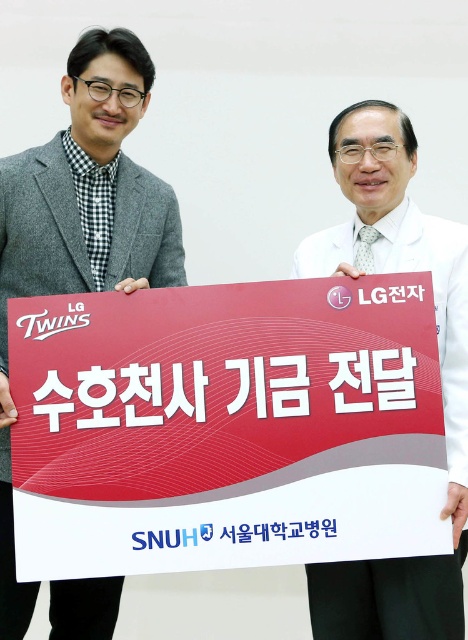
You are a photographer who needs to adjust the lighting to ensure both the red paper sign at center and the white lab coat at center are well lit. Which object should you focus the light on first to account for their size differences?

The red paper sign at center is shorter than the white lab coat at center, so you should focus the light on the white lab coat at center first since it is larger and may require more even lighting to ensure proper exposure.

You are a photographer who needs to position a tripod to capture both the red paper sign at center and the white lab coat at center clearly. Based on their positions, which object should you focus on first to ensure both are in frame?

The red paper sign at center is to the left of the white lab coat at center, so you should focus on the white lab coat at center first to ensure both are in frame.